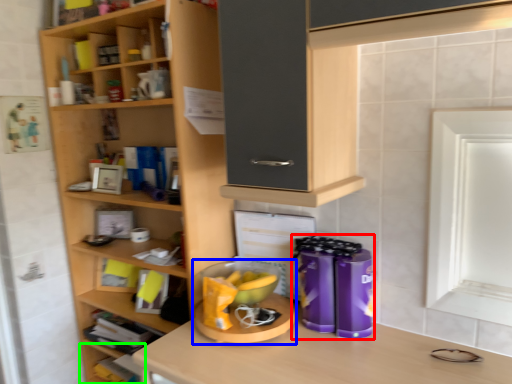
Question: Considering the real-world distances, which object is closest to appliance (highlighted by a red box)? appliance (highlighted by a blue box) or shelf (highlighted by a green box).

Choices:
 (A) appliance
 (B) shelf

Answer: (A)